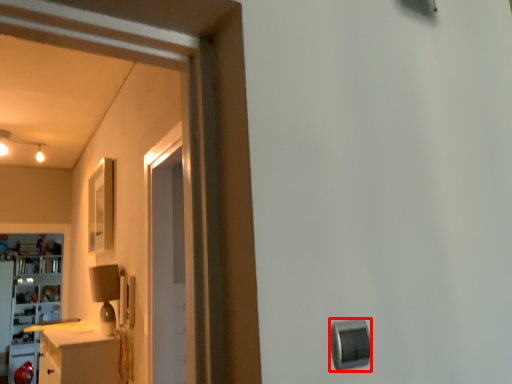
Question: Considering the relative positions of knob (annotated by the red box) and cabinetry in the image provided, where is knob (annotated by the red box) located with respect to the staircase?

Choices:
 (A) left
 (B) right

Answer: (B)